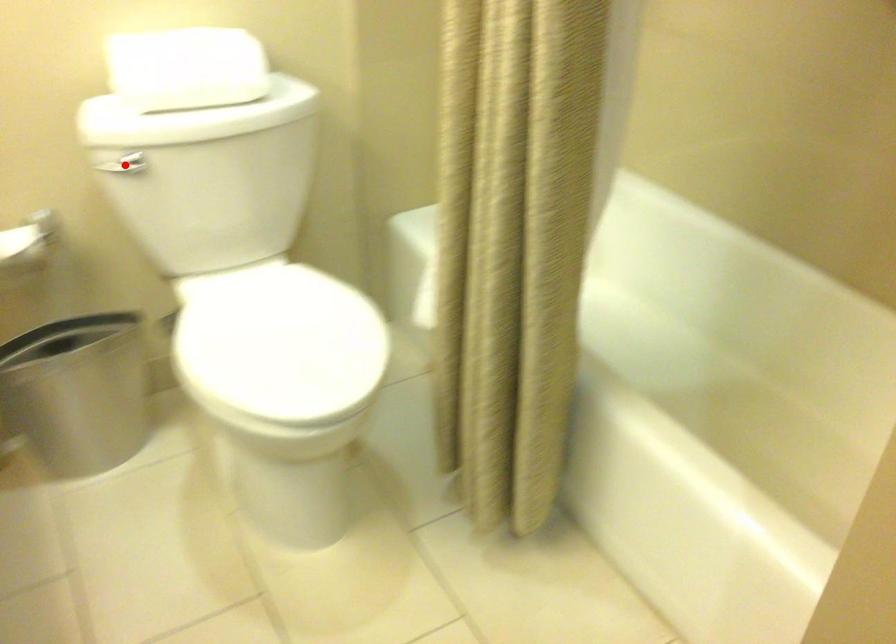
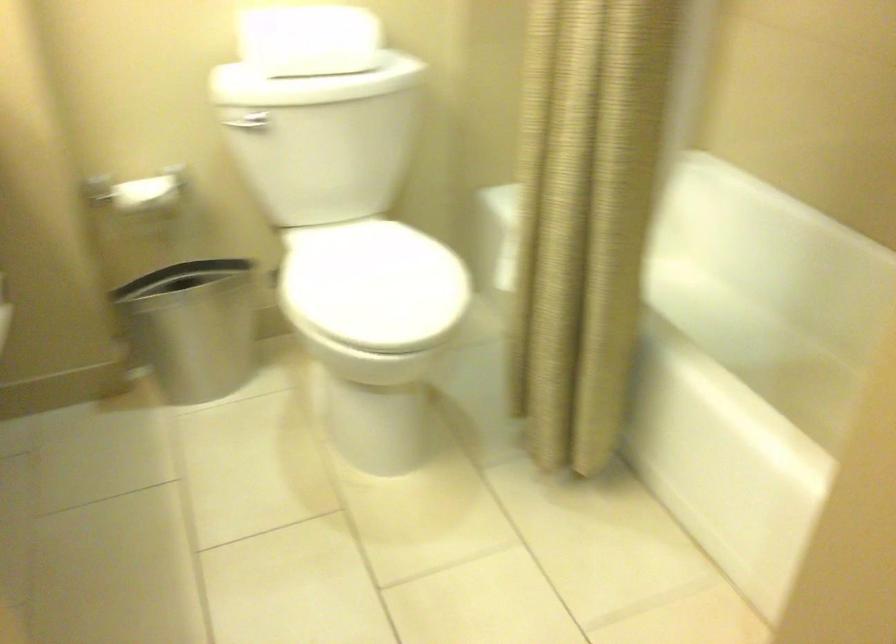
Locate, in the second image, the point that corresponds to the highlighted location in the first image.

(247, 122)